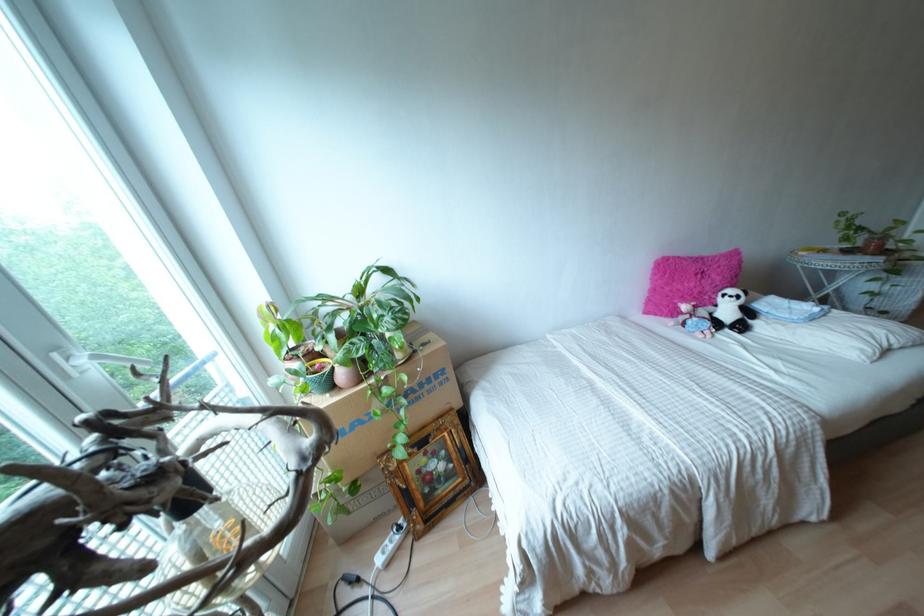
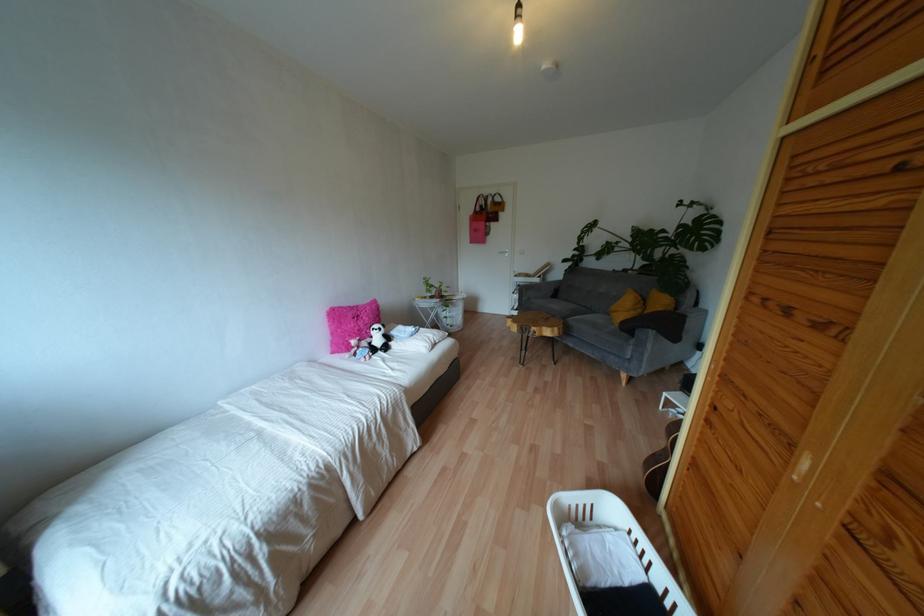
The point at (x=883, y=312) is marked in the first image. Where is the corresponding point in the second image?

(450, 325)